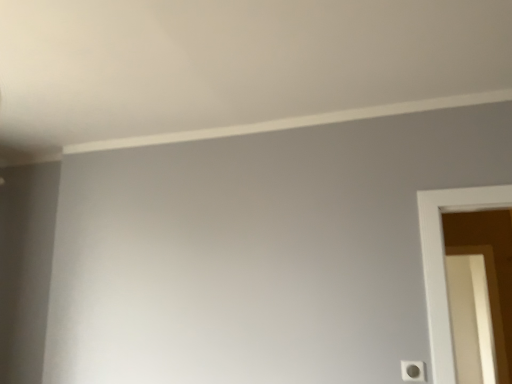
Question: Is white plastic light switch at lower right taller or shorter than white glossy screen door at right?

Choices:
 (A) short
 (B) tall

Answer: (A)

Question: Looking at their shapes, would you say white plastic light switch at lower right is wider or thinner than white glossy screen door at right?

Choices:
 (A) wide
 (B) thin

Answer: (B)

Question: From a real-world perspective, relative to white glossy screen door at right, is white plastic light switch at lower right vertically above or below?

Choices:
 (A) above
 (B) below

Answer: (B)

Question: Is white glossy screen door at right in front of or behind white plastic light switch at lower right in the image?

Choices:
 (A) front
 (B) behind

Answer: (B)

Question: Based on their sizes in the image, would you say white glossy screen door at right is bigger or smaller than white plastic light switch at lower right?

Choices:
 (A) big
 (B) small

Answer: (A)

Question: Is white glossy screen door at right to the left or to the right of white plastic light switch at lower right in the image?

Choices:
 (A) right
 (B) left

Answer: (A)

Question: From the image's perspective, is white glossy screen door at right above or below white plastic light switch at lower right?

Choices:
 (A) below
 (B) above

Answer: (A)